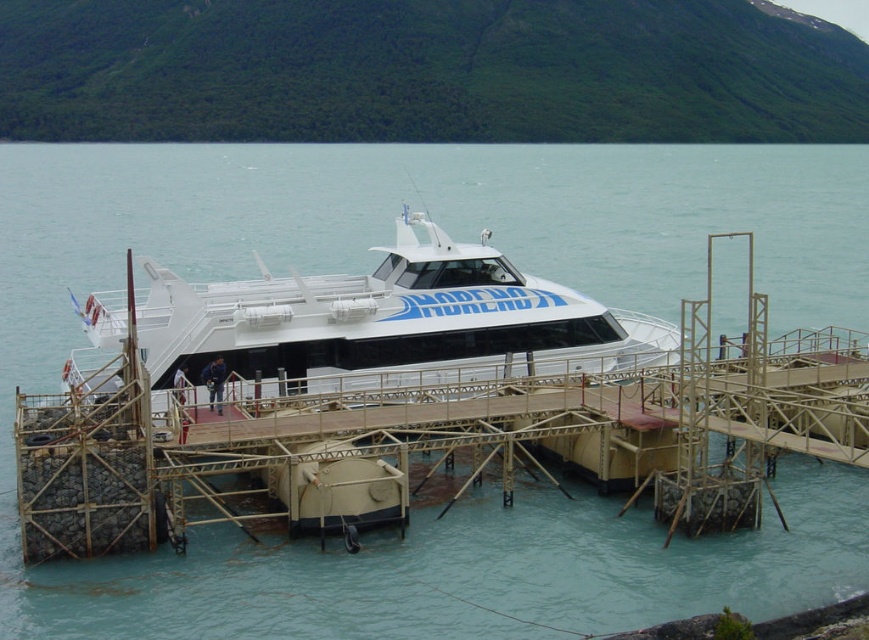
Question: Is wooden dock at center smaller than white glossy cruise ship at center?

Choices:
 (A) no
 (B) yes

Answer: (A)

Question: Among these objects, which one is farthest from the camera?

Choices:
 (A) white glossy cruise ship at center
 (B) wooden dock at center

Answer: (A)

Question: Can you confirm if wooden dock at center is thinner than white glossy cruise ship at center?

Choices:
 (A) yes
 (B) no

Answer: (B)

Question: Is wooden dock at center thinner than white glossy cruise ship at center?

Choices:
 (A) no
 (B) yes

Answer: (A)